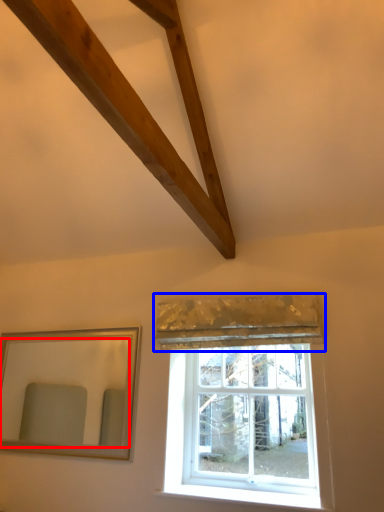
Question: Which object is further to the camera taking this photo, mirror (highlighted by a red box) or curtain (highlighted by a blue box)?

Choices:
 (A) mirror
 (B) curtain

Answer: (A)